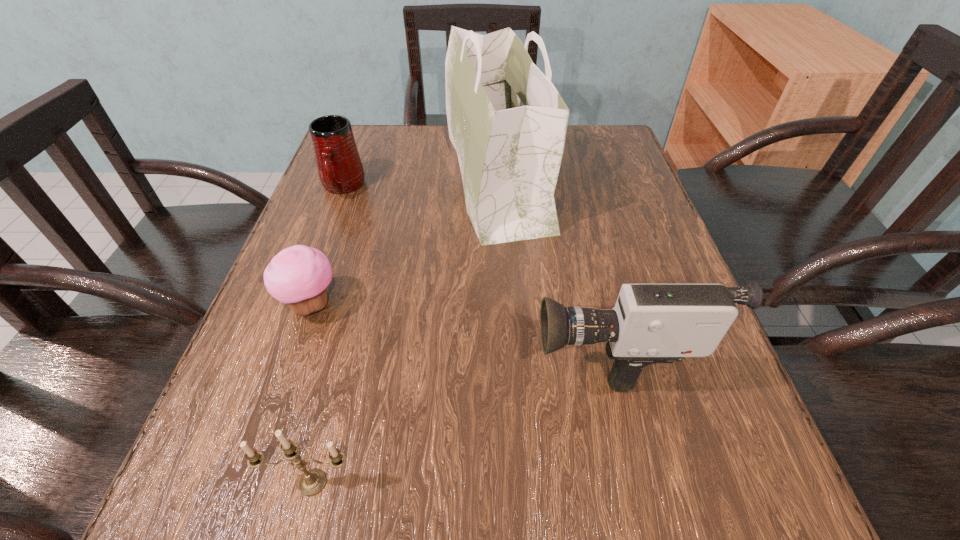
What are the coordinates of `vacant space located on the back of the nearest object` in the screenshot? It's located at (333, 404).

At what (x,y) coordinates should I click in order to perform the action: click on free space located on the back of the cupcake. Please return your answer as a coordinate pair (x, y). Looking at the image, I should click on (345, 209).

Image resolution: width=960 pixels, height=540 pixels. I want to click on grocery bag present at the far edge, so click(x=507, y=122).

Identify the location of mug that is at the far edge. The image size is (960, 540). click(x=340, y=169).

Find the location of `object that is at the near edge`. object that is at the near edge is located at coordinates (313, 481).

At what (x,y) coordinates should I click in order to perform the action: click on mug that is at the left edge. Please return your answer as a coordinate pair (x, y). Looking at the image, I should click on (340, 169).

The image size is (960, 540). I want to click on candle situated at the left edge, so click(313, 481).

The height and width of the screenshot is (540, 960). What are the coordinates of `cupcake present at the left edge` in the screenshot? It's located at (298, 276).

Identify the location of object located at the right edge. (651, 323).

This screenshot has height=540, width=960. What are the coordinates of `object at the far left corner` in the screenshot? It's located at (340, 169).